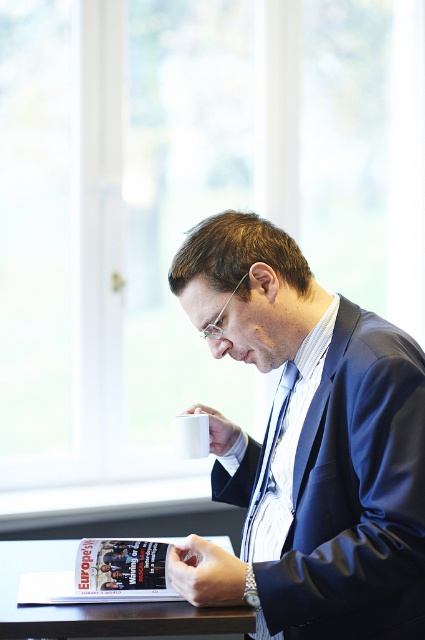
Question: Which object appears closest to the camera in this image?

Choices:
 (A) blue silk tie at center
 (B) blue glossy suit at center

Answer: (B)

Question: Is matte paper magazine at lower center thinner than blue silk tie at center?

Choices:
 (A) no
 (B) yes

Answer: (A)

Question: Which object is farther from the camera taking this photo?

Choices:
 (A) blue silk tie at center
 (B) blue glossy suit at center

Answer: (A)

Question: Can you confirm if blue glossy suit at center is positioned to the left of matte paper magazine at lower center?

Choices:
 (A) no
 (B) yes

Answer: (A)

Question: Observing the image, what is the correct spatial positioning of blue glossy suit at center in reference to blue silk tie at center?

Choices:
 (A) above
 (B) below

Answer: (A)

Question: Which object is positioned closest to the blue glossy suit at center?

Choices:
 (A) matte paper magazine at lower center
 (B) blue silk tie at center

Answer: (B)